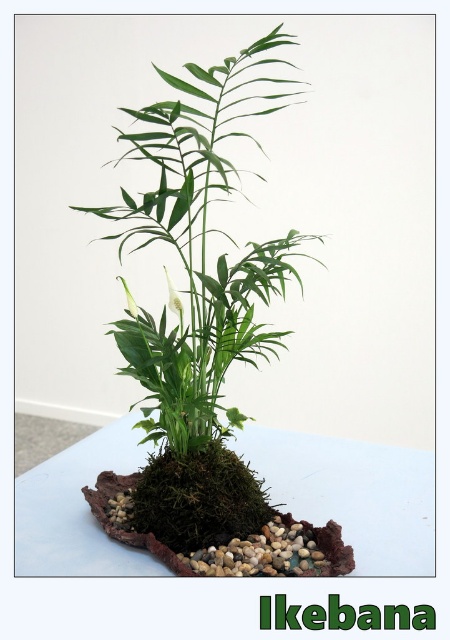
Question: Is the position of white matte table at center more distant than that of white matte flower at center?

Choices:
 (A) no
 (B) yes

Answer: (A)

Question: Which of the following is the farthest from the observer?

Choices:
 (A) (131, 308)
 (B) (174, 307)

Answer: (A)

Question: Which object is closer to the camera taking this photo?

Choices:
 (A) white matte flower at center
 (B) white matte table at center
 (C) green mossy plant at center

Answer: (C)

Question: Does green mossy plant at center have a greater width compared to white glossy flower at center?

Choices:
 (A) yes
 (B) no

Answer: (A)

Question: Does white matte table at center appear on the left side of white glossy flower at center?

Choices:
 (A) yes
 (B) no

Answer: (B)

Question: Which object is the closest to the white glossy flower at center?

Choices:
 (A) white matte flower at center
 (B) green mossy plant at center

Answer: (A)